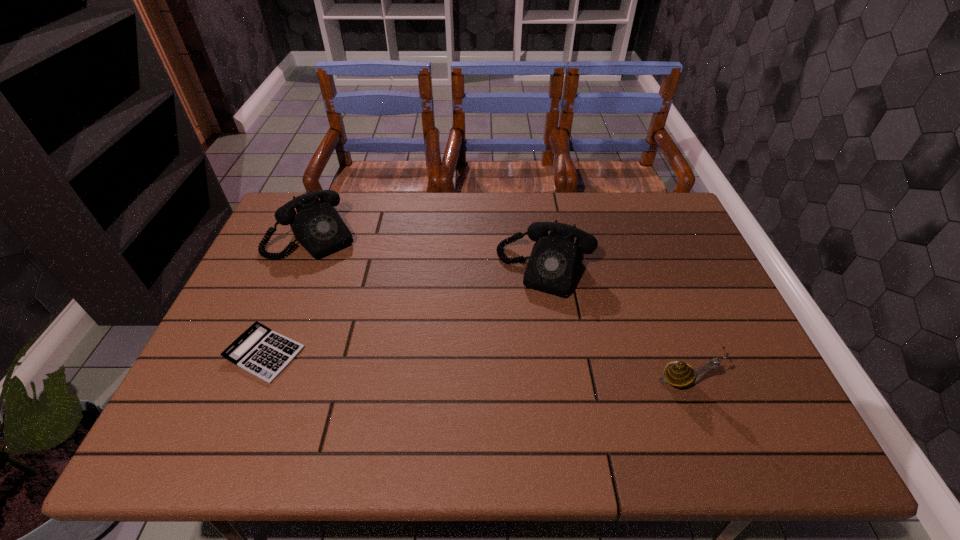
The width and height of the screenshot is (960, 540). Identify the location of vacant region located 0.050m on the dial of the left telephone. (340, 265).

Locate an element on the screen. Image resolution: width=960 pixels, height=540 pixels. vacant region located 0.120m on the dial of the left telephone is located at coordinates (351, 278).

Where is `object that is at the far edge`? The image size is (960, 540). object that is at the far edge is located at coordinates (317, 226).

This screenshot has width=960, height=540. Find the location of `calculator that is at the near edge`. calculator that is at the near edge is located at coordinates (259, 350).

What are the coordinates of `snail present at the near edge` in the screenshot? It's located at (679, 374).

I want to click on calculator present at the left edge, so click(259, 350).

At what (x,y) coordinates should I click in order to perform the action: click on telephone that is at the left edge. Please return your answer as a coordinate pair (x, y). Looking at the image, I should click on (317, 226).

I want to click on object positioned at the right edge, so click(679, 374).

Locate an element on the screen. This screenshot has width=960, height=540. object that is positioned at the far left corner is located at coordinates (317, 226).

Identify the location of object at the near left corner. pos(259,350).